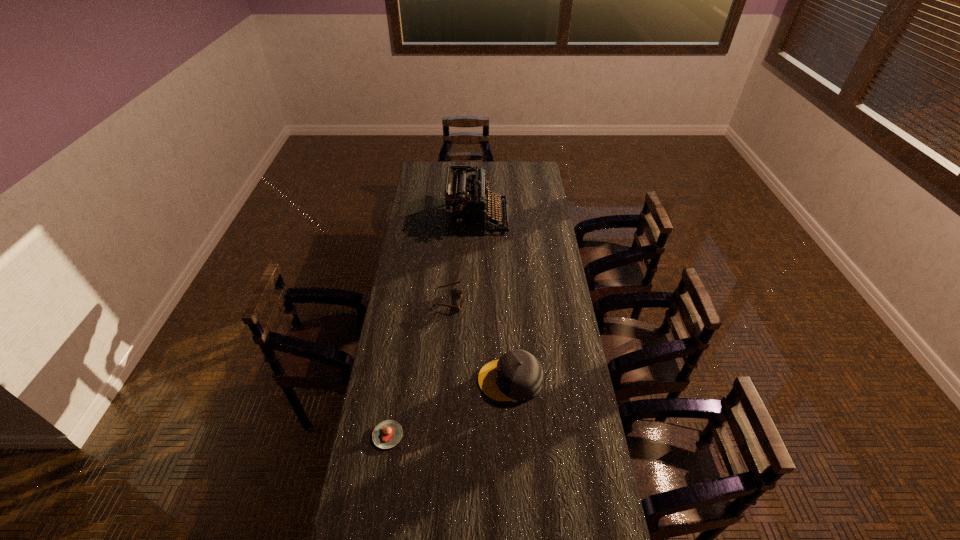
Find the location of `the tallest object`. the tallest object is located at coordinates (465, 206).

The width and height of the screenshot is (960, 540). What are the coordinates of `typewriter` in the screenshot? It's located at (465, 206).

Find the location of a particular element. the second tallest object is located at coordinates (517, 375).

Where is `cap`? cap is located at coordinates (517, 375).

You are a GUI agent. You are given a task and a screenshot of the screen. Output one action in this format:
    pyautogui.click(x=<x>, y=<y>)
    Task: Click on the sunglasses
    The width and height of the screenshot is (960, 540).
    Given the screenshot: What is the action you would take?
    pyautogui.click(x=459, y=306)

In order to click on the second farthest object in this screenshot , I will do click(459, 306).

Find the location of a particular element. The height and width of the screenshot is (540, 960). the shortest object is located at coordinates (387, 434).

Image resolution: width=960 pixels, height=540 pixels. Identify the location of pastry. (387, 434).

The height and width of the screenshot is (540, 960). What are the coordinates of `vacant area situated 0.160m on the typing side of the farthest object` in the screenshot? It's located at [x=538, y=219].

Where is `blank space located 0.270m on the front-facing side of the second nearest object`? This screenshot has height=540, width=960. blank space located 0.270m on the front-facing side of the second nearest object is located at coordinates (405, 380).